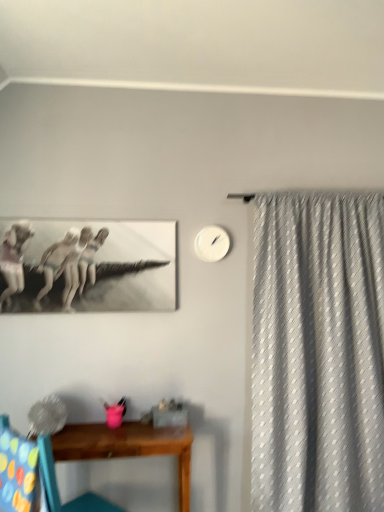
Where is `wooden table at lower center`? Image resolution: width=384 pixels, height=512 pixels. wooden table at lower center is located at coordinates (127, 447).

In order to click on wooden table at lower center in this screenshot , I will do `click(127, 447)`.

Where is `swivel chair below the white textured curtain at right (from the image's perspective)`? The height and width of the screenshot is (512, 384). swivel chair below the white textured curtain at right (from the image's perspective) is located at coordinates (17, 470).

Based on the photo, in the image, is multicolored fabric swivel chair at lower left positioned in front of or behind white textured curtain at right?

multicolored fabric swivel chair at lower left is in front of white textured curtain at right.

From a real-world perspective, which is physically above, multicolored fabric swivel chair at lower left or white textured curtain at right?

white textured curtain at right, from a real-world perspective.

Is wooden table at lower center situated inside multicolored fabric swivel chair at lower left or outside?

The correct answer is: outside.

Does wooden table at lower center have a greater height compared to multicolored fabric swivel chair at lower left?

Indeed, wooden table at lower center has a greater height compared to multicolored fabric swivel chair at lower left.

Consider the image. Is wooden table at lower center with multicolored fabric swivel chair at lower left?

They are not placed beside each other.

Does wooden table at lower center come in front of multicolored fabric swivel chair at lower left?

No, the depth of wooden table at lower center is greater than that of multicolored fabric swivel chair at lower left.

Is point (319, 390) in front of point (3, 493)?

No, (319, 390) is behind (3, 493).

Does white textured curtain at right appear on the left side of multicolored fabric swivel chair at lower left?

In fact, white textured curtain at right is to the right of multicolored fabric swivel chair at lower left.

Looking at this image, which of these two, white textured curtain at right or multicolored fabric swivel chair at lower left, is wider?

With larger width is white textured curtain at right.

In the scene shown: Between white textured curtain at right and multicolored fabric swivel chair at lower left, which one is positioned behind?

white textured curtain at right is further from the camera.

Which of these two, white matte clock at upper center or white textured curtain at right, is thinner?

Thinner between the two is white matte clock at upper center.

Based on the photo, can you confirm if white matte clock at upper center is taller than white textured curtain at right?

In fact, white matte clock at upper center may be shorter than white textured curtain at right.

Find the location of a particular element. clock located behind the white textured curtain at right is located at coordinates (212, 243).

Is wooden table at lower center not within wooden chair at lower left?

Yes, wooden table at lower center is located beyond the bounds of wooden chair at lower left.

Does wooden table at lower center have a greater height compared to wooden chair at lower left?

No, wooden table at lower center is not taller than wooden chair at lower left.

Find the location of a particular element. Image resolution: width=384 pixels, height=512 pixels. table beneath the wooden chair at lower left (from a real-world perspective) is located at coordinates (127, 447).

Could you tell me if wooden table at lower center is facing wooden chair at lower left?

Yes, wooden table at lower center is facing wooden chair at lower left.

From the picture: Considering the sizes of objects wooden table at lower center and white matte clock at upper center in the image provided, who is wider, wooden table at lower center or white matte clock at upper center?

Wider between the two is wooden table at lower center.

Find the location of a particular element. This screenshot has height=512, width=384. table below the white matte clock at upper center (from the image's perspective) is located at coordinates (127, 447).

In the image, is wooden table at lower center on the left side or the right side of white matte clock at upper center?

Based on their positions, wooden table at lower center is located to the left of white matte clock at upper center.

Is wooden table at lower center facing away from white matte clock at upper center?

No.

In the image, is white textured curtain at right positioned in front of or behind wooden chair at lower left?

In the image, white textured curtain at right appears behind wooden chair at lower left.

Can you confirm if white textured curtain at right is thinner than wooden chair at lower left?

Correct, the width of white textured curtain at right is less than that of wooden chair at lower left.

Is point (258, 466) closer to viewer compared to point (71, 502)?

No, it is behind (71, 502).

What's the angular difference between white textured curtain at right and wooden chair at lower left's facing directions?

131 degrees.

The image size is (384, 512). What are the coordinates of `swivel chair below the white textured curtain at right (from a real-world perspective)` in the screenshot? It's located at (17, 470).

In order to click on swivel chair above the wooden table at lower center (from a real-world perspective) in this screenshot , I will do `click(17, 470)`.

Estimate the real-world distances between objects in this image. Which object is closer to white matte clock at upper center, wooden table at lower center or white textured curtain at right?

Among the two, white textured curtain at right is located nearer to white matte clock at upper center.

From the image, which object appears to be nearer to multicolored fabric swivel chair at lower left, white textured curtain at right or wooden chair at lower left?

Among the two, wooden chair at lower left is located nearer to multicolored fabric swivel chair at lower left.

Estimate the real-world distances between objects in this image. Which object is closer to white textured curtain at right, multicolored fabric swivel chair at lower left or wooden table at lower center?

wooden table at lower center.

Which object lies further to the anchor point wooden chair at lower left, wooden table at lower center or white textured curtain at right?

white textured curtain at right lies further to wooden chair at lower left than the other object.

From the image, which object appears to be nearer to white textured curtain at right, wooden table at lower center or white matte clock at upper center?

Based on the image, white matte clock at upper center appears to be nearer to white textured curtain at right.

When comparing their distances from white textured curtain at right, does multicolored fabric swivel chair at lower left or wooden chair at lower left seem closer?

wooden chair at lower left.

Based on their spatial positions, is white textured curtain at right or wooden chair at lower left closer to wooden table at lower center?

Among the two, wooden chair at lower left is located nearer to wooden table at lower center.

Looking at the image, which one is located further to white textured curtain at right, multicolored fabric swivel chair at lower left or white matte clock at upper center?

Based on the image, multicolored fabric swivel chair at lower left appears to be further to white textured curtain at right.

This screenshot has width=384, height=512. In order to click on chair between white matte clock at upper center and wooden table at lower center from top to bottom in this screenshot , I will do `click(58, 490)`.

Identify the location of table located between wooden chair at lower left and white textured curtain at right in the left-right direction. [127, 447].

At what (x,y) coordinates should I click in order to perform the action: click on chair between multicolored fabric swivel chair at lower left and white textured curtain at right in the horizontal direction. Please return your answer as a coordinate pair (x, y). This screenshot has height=512, width=384. Looking at the image, I should click on (58, 490).

The image size is (384, 512). Find the location of `table situated between multicolored fabric swivel chair at lower left and white textured curtain at right from left to right`. table situated between multicolored fabric swivel chair at lower left and white textured curtain at right from left to right is located at coordinates (127, 447).